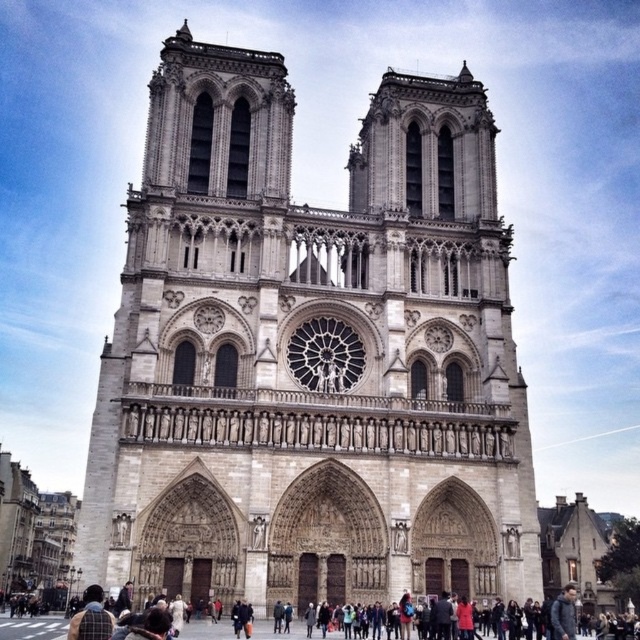
Question: Is stone cathedral at center thinner than dark gray coat at lower center?

Choices:
 (A) no
 (B) yes

Answer: (A)

Question: Does stone cathedral at center have a greater width compared to dark gray coat at lower center?

Choices:
 (A) no
 (B) yes

Answer: (B)

Question: Does stone cathedral at center have a greater width compared to dark gray coat at lower center?

Choices:
 (A) no
 (B) yes

Answer: (B)

Question: Which of the following is the farthest from the observer?

Choices:
 (A) stone cathedral at center
 (B) dark gray coat at lower center

Answer: (A)